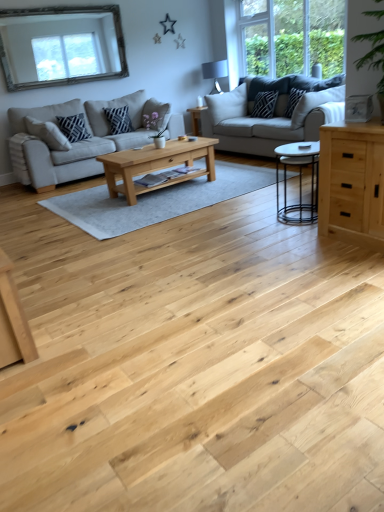
Image resolution: width=384 pixels, height=512 pixels. What are the coordinates of `blank space to the left of natural wood chest of drawers at right` in the screenshot? It's located at pyautogui.click(x=308, y=247).